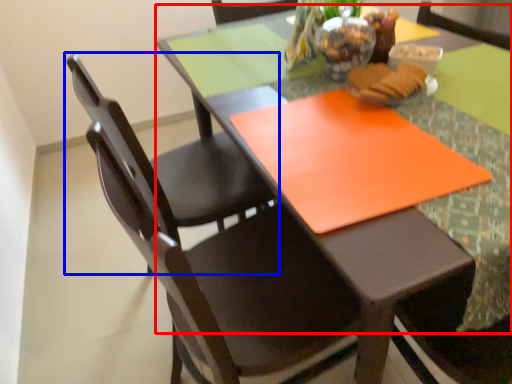
Question: Which object appears closest to the camera in this image, round table (highlighted by a red box) or chair (highlighted by a blue box)?

Choices:
 (A) round table
 (B) chair

Answer: (A)